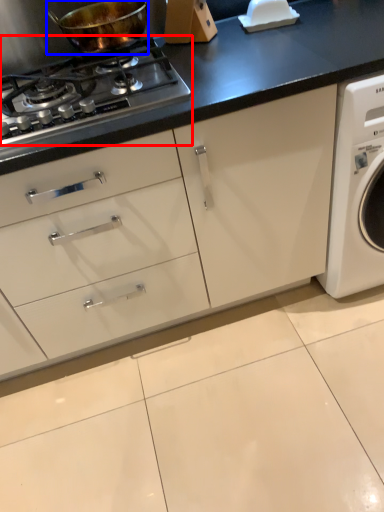
Question: Which point is further to the camera, gas stove (highlighted by a red box) or kitchen appliance (highlighted by a blue box)?

Choices:
 (A) gas stove
 (B) kitchen appliance

Answer: (B)